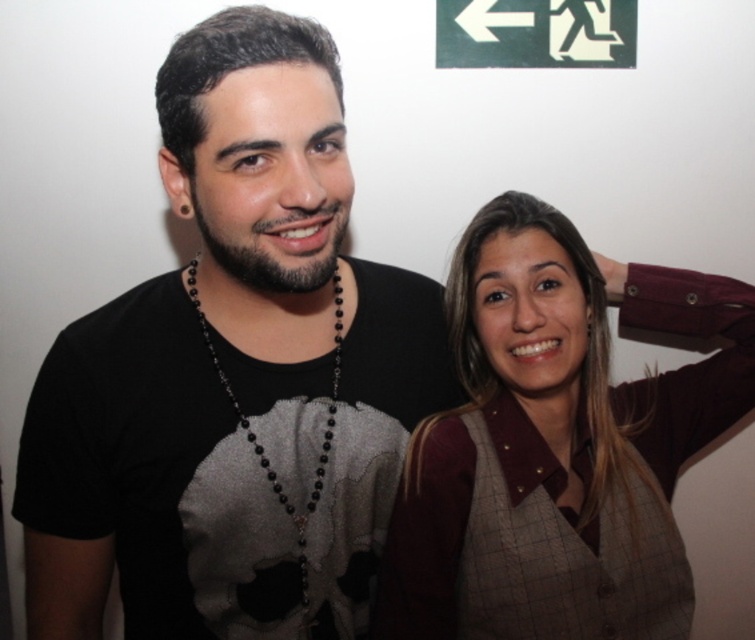
Does black matte t-shirt at center have a greater width compared to plaid fabric vest at right?

No, black matte t-shirt at center is not wider than plaid fabric vest at right.

Does black matte t-shirt at center lie behind plaid fabric vest at right?

No, it is in front of plaid fabric vest at right.

The width and height of the screenshot is (755, 640). Find the location of `black matte t-shirt at center`. black matte t-shirt at center is located at coordinates (233, 374).